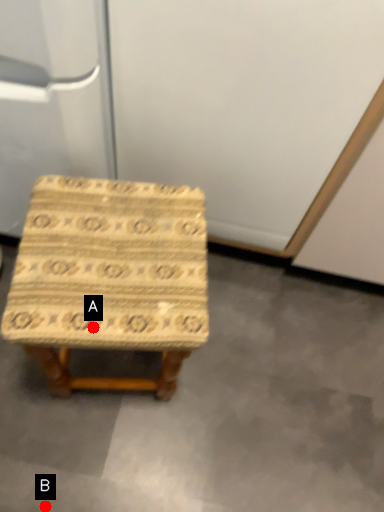
Question: Two points are circled on the image, labeled by A and B beside each circle. Which point appears farthest from the camera in this image?

Choices:
 (A) A is further
 (B) B is further

Answer: (B)